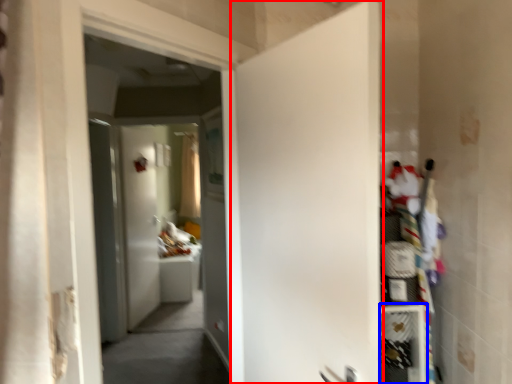
Question: Among these objects, which one is nearest to the camera, door (highlighted by a red box) or shelf (highlighted by a blue box)?

Choices:
 (A) door
 (B) shelf

Answer: (A)